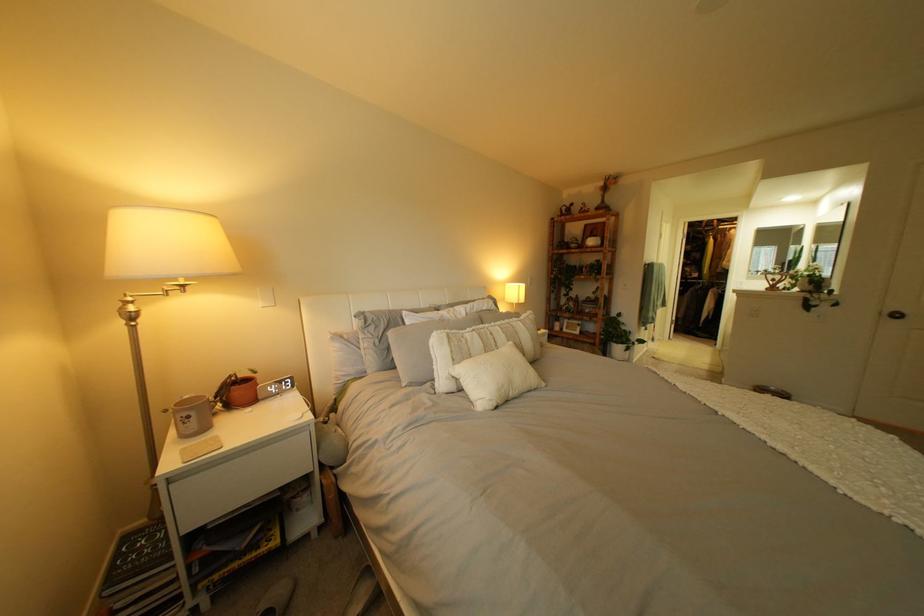
At what (x,y) coordinates should I click in order to perform the action: click on white light switch. Please return your answer as a coordinate pair (x, y). Looking at the image, I should click on (265, 296).